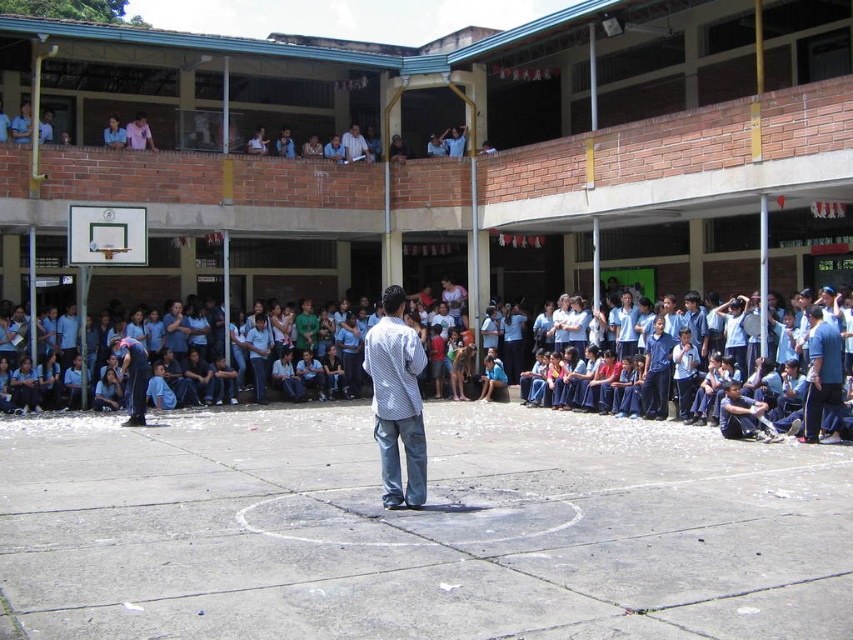
Between point (714, 404) and point (407, 330), which one is positioned in front?

Point (407, 330)

Can you confirm if blue uniform at center is taller than white checkered shirt at center?

Yes, blue uniform at center is taller than white checkered shirt at center.

Is point (492, 371) positioned in front of point (416, 449)?

No, (492, 371) is behind (416, 449).

This screenshot has width=853, height=640. I want to click on blue uniform at center, so click(x=666, y=387).

Is white checkered shirt at center positioned behind white striped shirt at center?

No, it is not.

Image resolution: width=853 pixels, height=640 pixels. Describe the element at coordinates (396, 401) in the screenshot. I see `white checkered shirt at center` at that location.

You are a GUI agent. You are given a task and a screenshot of the screen. Output one action in this format:
    pyautogui.click(x=<x>, y=<y>)
    Task: Click on the white checkered shirt at center
    
    Given the screenshot: What is the action you would take?
    pyautogui.click(x=396, y=401)

Between blue uniform at center and blue uniform at right, which one appears on the left side from the viewer's perspective?

Positioned to the left is blue uniform at center.

Between blue uniform at center and blue uniform at right, which one is positioned lower?

blue uniform at right is below.

Who is more distant from viewer, (x=692, y=387) or (x=821, y=340)?

Positioned behind is point (x=692, y=387).

At what (x,y) coordinates should I click in order to perform the action: click on blue uniform at center. Please return your answer as a coordinate pair (x, y). Image resolution: width=853 pixels, height=640 pixels. Looking at the image, I should click on (666, 387).